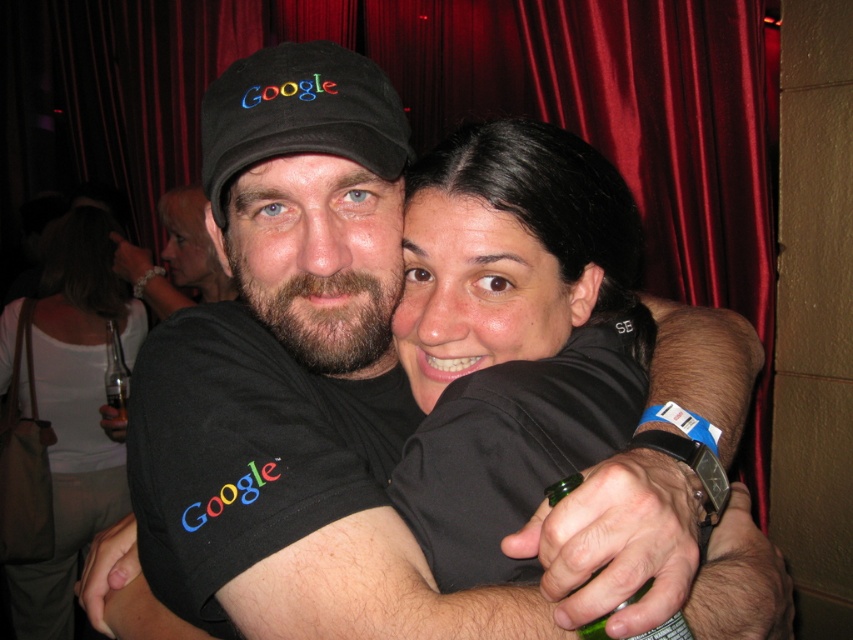
You are at a social event and see two people in the image. The white matte shirt at upper center and the matte black shirt at center. Which shirt is lower in position?

The white matte shirt at upper center is positioned under the matte black shirt at center, so the white matte shirt at upper center is lower.

You are standing in the center of the room where the social event is taking place. You want to locate the white matte shirt at upper center. Which direction should you look to find it?

You should look towards the upper center direction to find the white matte shirt at upper center since it is located at point [74,412].